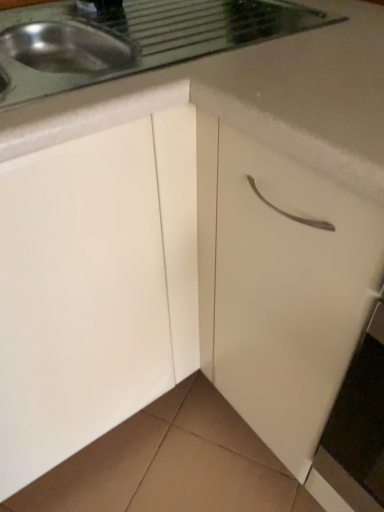
Question: In terms of height, does white matte drawer at center look taller or shorter compared to white glossy countertop at upper center?

Choices:
 (A) tall
 (B) short

Answer: (A)

Question: Is point (291, 352) positioned closer to the camera than point (274, 53)?

Choices:
 (A) closer
 (B) farther

Answer: (B)

Question: Which is correct: white matte drawer at center is inside white glossy countertop at upper center, or outside of it?

Choices:
 (A) inside
 (B) outside

Answer: (B)

Question: From the image's perspective, is white glossy countertop at upper center positioned above or below white matte drawer at center?

Choices:
 (A) below
 (B) above

Answer: (B)

Question: From a real-world perspective, is white glossy countertop at upper center positioned above or below white matte drawer at center?

Choices:
 (A) below
 (B) above

Answer: (B)

Question: Does point (357, 34) appear closer or farther from the camera than point (223, 245)?

Choices:
 (A) farther
 (B) closer

Answer: (B)

Question: Which is correct: white glossy countertop at upper center is inside white matte drawer at center, or outside of it?

Choices:
 (A) inside
 (B) outside

Answer: (B)